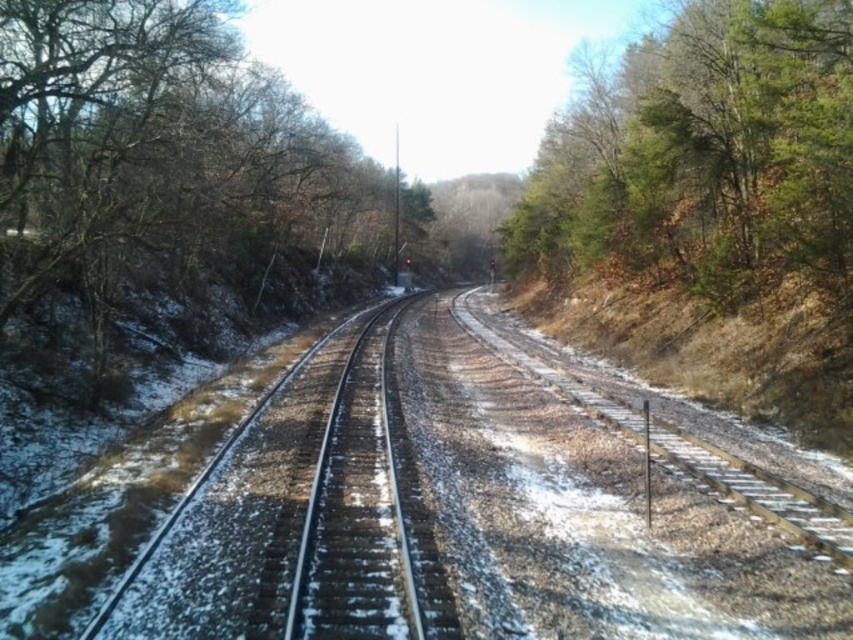
Question: Can you confirm if bare branches at left is positioned above green leafy tree at right?

Choices:
 (A) yes
 (B) no

Answer: (A)

Question: Which point appears farthest from the camera in this image?

Choices:
 (A) (688, 86)
 (B) (329, 150)

Answer: (B)

Question: Can you confirm if bare branches at left is bigger than green leafy tree at right?

Choices:
 (A) no
 (B) yes

Answer: (B)

Question: Which point is closer to the camera?

Choices:
 (A) green leafy tree at right
 (B) bare branches at left

Answer: (A)

Question: Where is bare branches at left located in relation to green leafy tree at right in the image?

Choices:
 (A) below
 (B) above

Answer: (B)